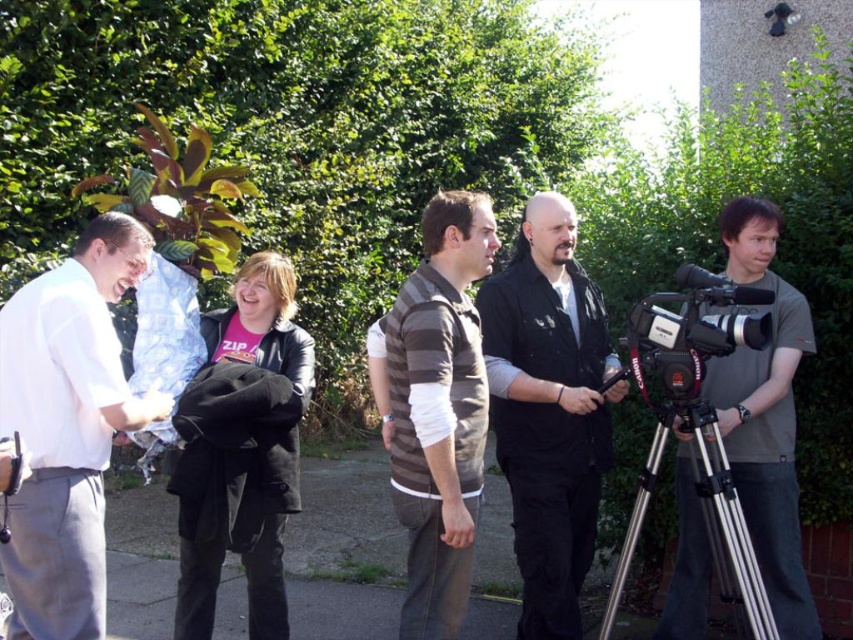
You are planning to take a photo of the group and want to ensure the black matte vest at center is in the frame. Based on its position, where should you aim the camera?

The black matte vest at center is located at point (x=549, y=410), so aim the camera at those coordinates to ensure it is in the frame.

You are a photographer at the event and need to capture a photo of the striped jersey at center without the gray matte camera at right appearing in the frame. Is this possible given their positions?

The striped jersey at center is located above the gray matte camera at right, so if you position the camera to focus on the upper area where the striped jersey at center is, you can avoid including the gray matte camera at right in the frame.

You are a photographer at the event and need to position yourself so that the striped jersey at center and the silver metallic tripod at lower right are both visible in your shot. Based on their positions, which object is closer to the camera?

The striped jersey at center is located above the silver metallic tripod at lower right, which means it is closer to the camera since objects higher in the frame are typically nearer when looking downward.